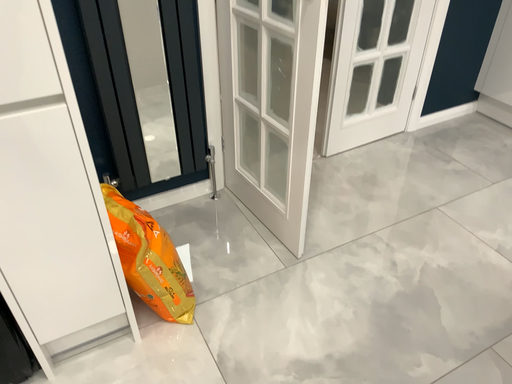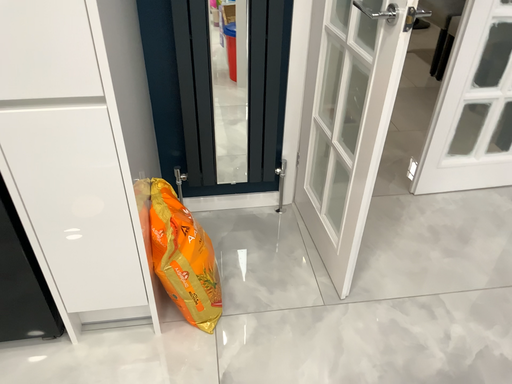
Question: Which way did the camera rotate in the video?

Choices:
 (A) rotated right
 (B) rotated left

Answer: (B)